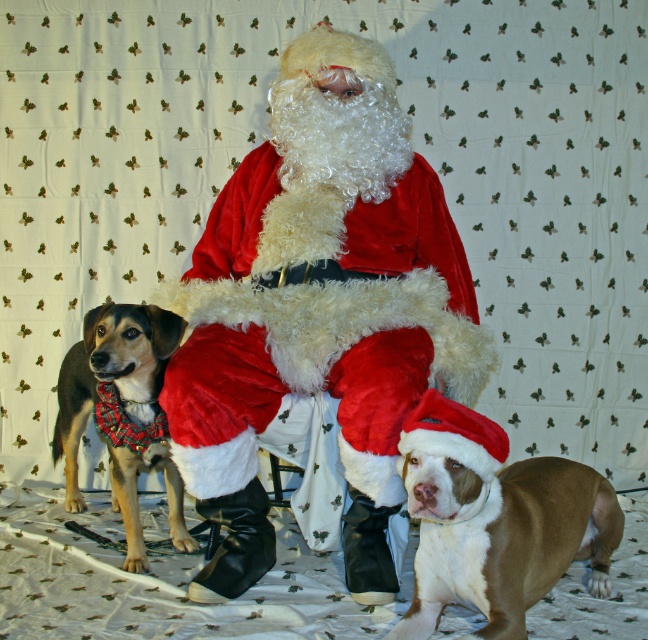
Can you confirm if velvet santa at center is positioned above plaid fabric dog at left?

Correct, velvet santa at center is located above plaid fabric dog at left.

What do you see at coordinates (319, 312) in the screenshot? I see `velvet santa at center` at bounding box center [319, 312].

What are the coordinates of `velvet santa at center` in the screenshot? It's located at (319, 312).

Does point (257, 509) lie in front of point (570, 529)?

No, (257, 509) is behind (570, 529).

Locate an element on the screen. This screenshot has height=640, width=648. velvet santa at center is located at coordinates (319, 312).

Can you confirm if brown and white fur at lower right is positioned above plaid fabric dog at left?

No.

Who is taller, brown and white fur at lower right or plaid fabric dog at left?

With more height is plaid fabric dog at left.

Is point (568, 464) farther from viewer compared to point (93, 396)?

No, (568, 464) is in front of (93, 396).

The width and height of the screenshot is (648, 640). I want to click on brown and white fur at lower right, so click(x=494, y=520).